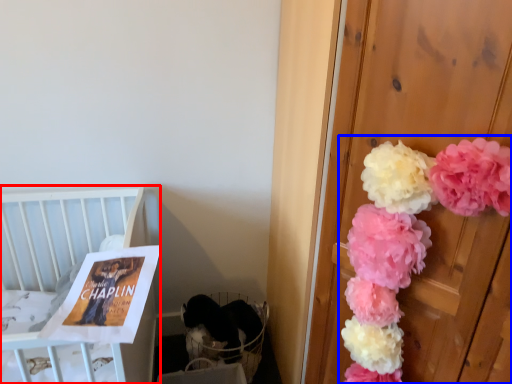
Question: Which object is closer to the camera taking this photo, furniture (highlighted by a red box) or floral arrangement (highlighted by a blue box)?

Choices:
 (A) furniture
 (B) floral arrangement

Answer: (B)